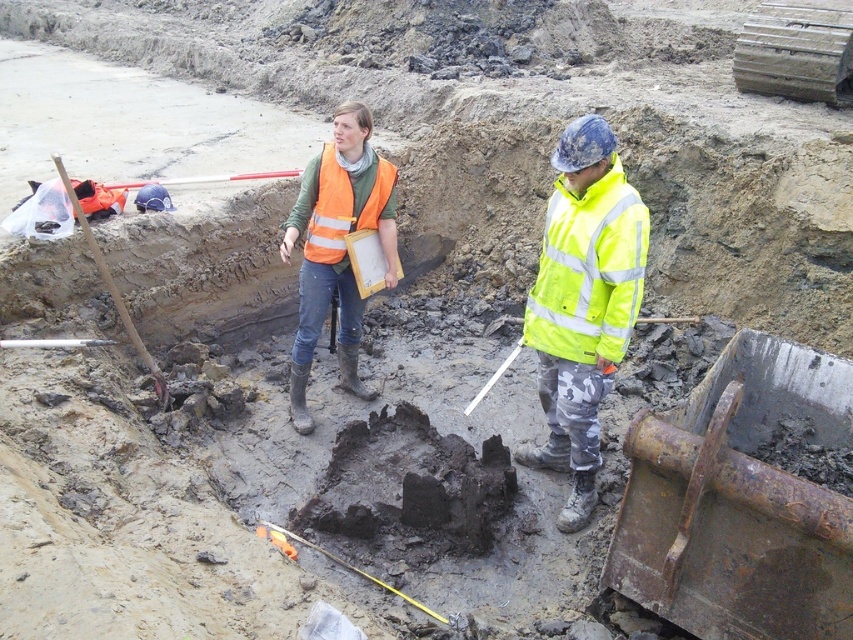
You are standing at the origin point in the image. The reflective orange vest at center is located at coordinates 0.386, 0.396. If you want to move directly towards it, in which direction should you move?

To move directly towards the reflective orange vest at center located at coordinates (337, 246) from the origin, you should move northeast since the x and y coordinates are both positive.